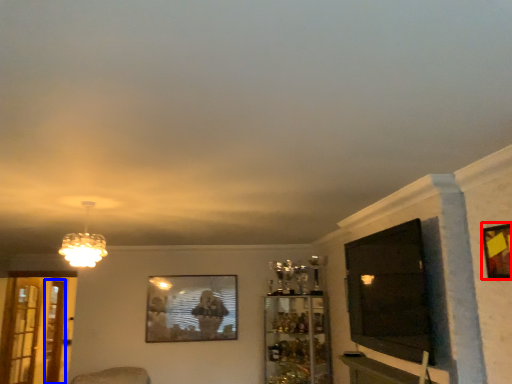
Question: Among these objects, which one is nearest to the camera, picture frame (highlighted by a red box) or screen door (highlighted by a blue box)?

Choices:
 (A) picture frame
 (B) screen door

Answer: (A)